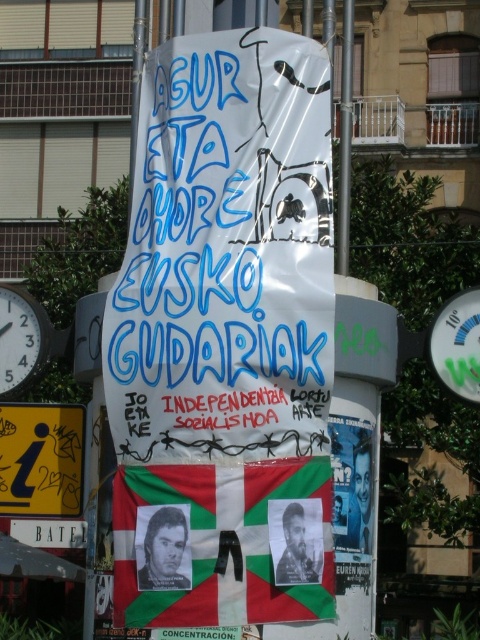
Question: Which point is closer to the camera taking this photo?

Choices:
 (A) (28, 305)
 (B) (460, 346)

Answer: (B)

Question: Can you confirm if white paper poster at center is positioned above metallic clock face at left?

Choices:
 (A) yes
 (B) no

Answer: (B)

Question: Does yellow plastic sign at lower left appear on the left side of metallic clock face at left?

Choices:
 (A) yes
 (B) no

Answer: (A)

Question: Is white paper poster at center to the left of matte black photo at center from the viewer's perspective?

Choices:
 (A) yes
 (B) no

Answer: (B)

Question: Which object appears closest to the camera in this image?

Choices:
 (A) green and white flag at center
 (B) black glossy photo at center

Answer: (A)

Question: Estimate the real-world distances between objects in this image. Which object is farther from the green and white flag at center?

Choices:
 (A) black glossy photo at center
 (B) white paper poster at center
 (C) metallic clock face at left

Answer: (C)